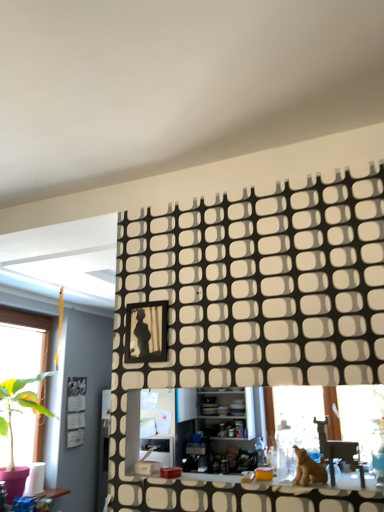
Image resolution: width=384 pixels, height=512 pixels. Find the location of `white glossy counter top at center`. white glossy counter top at center is located at coordinates (206, 478).

Describe the element at coordinates (260, 287) in the screenshot. This screenshot has height=512, width=384. I see `black textured wall panel at upper center` at that location.

Describe the element at coordinates (146, 332) in the screenshot. The width and height of the screenshot is (384, 512). I see `matte black picture frame at center` at that location.

Where is `white glossy counter top at center`? white glossy counter top at center is located at coordinates (206, 478).

Which object is thinner, matte black picture frame at center or black textured wall panel at upper center?

matte black picture frame at center.

From a real-world perspective, who is located lower, matte black picture frame at center or black textured wall panel at upper center?

In real-world perspective, black textured wall panel at upper center is lower.

Is matte black picture frame at center to the left of black textured wall panel at upper center from the viewer's perspective?

Correct, you'll find matte black picture frame at center to the left of black textured wall panel at upper center.

I want to click on picture frame that appears on the left of black textured wall panel at upper center, so click(146, 332).

Considering the positions of points (134, 309) and (334, 457), is point (134, 309) farther from camera compared to point (334, 457)?

Yes, it is behind point (334, 457).

Can you confirm if matte black picture frame at center is positioned to the left of metallic silver swivel chair at lower right?

Indeed, matte black picture frame at center is positioned on the left side of metallic silver swivel chair at lower right.

Could you tell me if matte black picture frame at center is turned towards metallic silver swivel chair at lower right?

No, matte black picture frame at center is not turned towards metallic silver swivel chair at lower right.

Is brown furry dog at lower right facing towards white glossy counter top at center?

No.

Is white glossy counter top at center completely or partially inside brown furry dog at lower right?

No, brown furry dog at lower right does not contain white glossy counter top at center.

Where is `animal that is on the right side of white glossy counter top at center`? The width and height of the screenshot is (384, 512). animal that is on the right side of white glossy counter top at center is located at coordinates (308, 469).

Considering the positions of objects brown furry dog at lower right and white glossy counter top at center in the image provided, who is behind, brown furry dog at lower right or white glossy counter top at center?

brown furry dog at lower right is behind.

Are matte black picture frame at center and white glossy counter top at center far apart?

No, matte black picture frame at center is not far away from white glossy counter top at center.

Is matte black picture frame at center looking in the opposite direction of white glossy counter top at center?

matte black picture frame at center does not have its back to white glossy counter top at center.

From a real-world perspective, which object stands above the other?

matte black picture frame at center, from a real-world perspective.

Could you tell me if white glossy counter top at center is turned towards brown furry dog at lower right?

No, white glossy counter top at center is not oriented towards brown furry dog at lower right.

Consider the image. Does white glossy counter top at center have a greater width compared to brown furry dog at lower right?

Yes, white glossy counter top at center is wider than brown furry dog at lower right.

Visually, is white glossy counter top at center positioned to the left or to the right of brown furry dog at lower right?

From the image, it's evident that white glossy counter top at center is to the left of brown furry dog at lower right.

Can we say white glossy counter top at center lies outside brown furry dog at lower right?

Yes.

Can you confirm if white glossy counter top at center is taller than matte black picture frame at center?

Incorrect, the height of white glossy counter top at center is not larger of that of matte black picture frame at center.

Is white glossy counter top at center turned away from matte black picture frame at center?

No, white glossy counter top at center is not facing the opposite direction of matte black picture frame at center.

From the image's perspective, is white glossy counter top at center positioned above or below matte black picture frame at center?

From the image's perspective, white glossy counter top at center appears below matte black picture frame at center.

Where is `counter top that appears in front of the matte black picture frame at center`? The width and height of the screenshot is (384, 512). counter top that appears in front of the matte black picture frame at center is located at coordinates (206, 478).

Considering the relative sizes of black textured wall panel at upper center and white glossy counter top at center in the image provided, is black textured wall panel at upper center thinner than white glossy counter top at center?

Indeed, black textured wall panel at upper center has a lesser width compared to white glossy counter top at center.

How different are the orientations of black textured wall panel at upper center and white glossy counter top at center in degrees?

179 degrees separate the facing orientations of black textured wall panel at upper center and white glossy counter top at center.

From a real-world perspective, does black textured wall panel at upper center stand above white glossy counter top at center?

Yes, from a real-world perspective, black textured wall panel at upper center is over white glossy counter top at center

Is black textured wall panel at upper center surrounding white glossy counter top at center?

No, white glossy counter top at center is located outside of black textured wall panel at upper center.

Locate an element on the screen. The width and height of the screenshot is (384, 512). pattern that appears in front of the matte black picture frame at center is located at coordinates (260, 287).

Where is `picture frame that is above the metallic silver swivel chair at lower right (from the image's perspective)`? The width and height of the screenshot is (384, 512). picture frame that is above the metallic silver swivel chair at lower right (from the image's perspective) is located at coordinates (146, 332).

When comparing their distances from black textured wall panel at upper center, does matte black picture frame at center or metallic silver swivel chair at lower right seem further?

Among the two, metallic silver swivel chair at lower right is located further to black textured wall panel at upper center.

Considering their positions, is brown furry dog at lower right positioned closer to matte black picture frame at center than black textured wall panel at upper center?

black textured wall panel at upper center.

Based on their spatial positions, is white glossy counter top at center or brown furry dog at lower right further from black textured wall panel at upper center?

white glossy counter top at center.

Estimate the real-world distances between objects in this image. Which object is further from black textured wall panel at upper center, matte black picture frame at center or white glossy counter top at center?

white glossy counter top at center.

Looking at the image, which one is located further to matte black picture frame at center, brown furry dog at lower right or white glossy counter top at center?

brown furry dog at lower right is further to matte black picture frame at center.

When comparing their distances from black textured wall panel at upper center, does matte black picture frame at center or brown furry dog at lower right seem closer?

The object closer to black textured wall panel at upper center is matte black picture frame at center.

When comparing their distances from matte black picture frame at center, does white glossy counter top at center or black textured wall panel at upper center seem closer?

Among the two, black textured wall panel at upper center is located nearer to matte black picture frame at center.

Looking at the image, which one is located closer to matte black picture frame at center, metallic silver swivel chair at lower right or white glossy counter top at center?

white glossy counter top at center lies closer to matte black picture frame at center than the other object.

This screenshot has width=384, height=512. I want to click on animal located between white glossy counter top at center and metallic silver swivel chair at lower right in the left-right direction, so click(308, 469).

The width and height of the screenshot is (384, 512). Find the location of `counter top between matte black picture frame at center and brown furry dog at lower right`. counter top between matte black picture frame at center and brown furry dog at lower right is located at coordinates click(x=206, y=478).

This screenshot has height=512, width=384. I want to click on pattern between matte black picture frame at center and brown furry dog at lower right, so click(x=260, y=287).

The height and width of the screenshot is (512, 384). What are the coordinates of `swivel chair between black textured wall panel at upper center and brown furry dog at lower right in the vertical direction` in the screenshot? It's located at (338, 451).